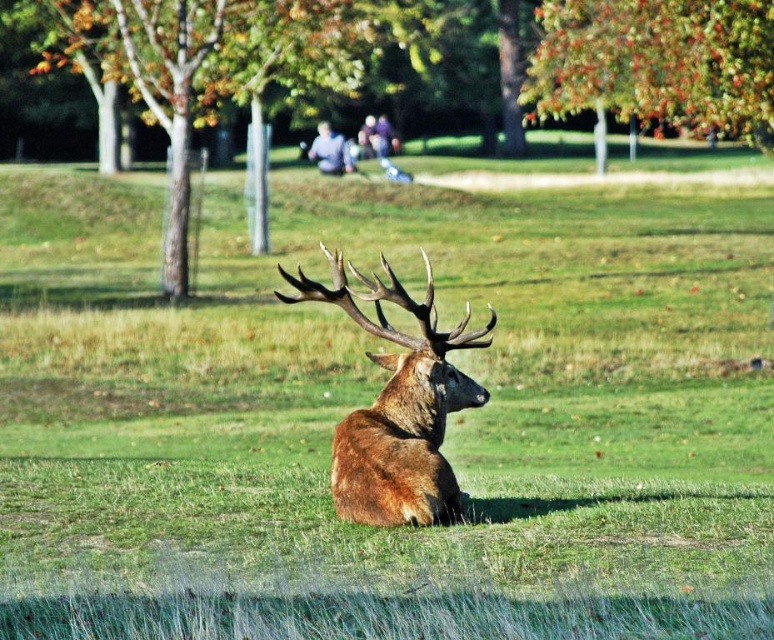
Question: Which of the following is the closest to the observer?

Choices:
 (A) (343, 509)
 (B) (690, 19)

Answer: (A)

Question: Does green leafy tree at upper center appear on the right side of brown velvet deer at center?

Choices:
 (A) yes
 (B) no

Answer: (A)

Question: Can you confirm if green leafy tree at upper center is smaller than brown velvet deer at center?

Choices:
 (A) no
 (B) yes

Answer: (A)

Question: Observing the image, what is the correct spatial positioning of green leafy tree at upper center in reference to brown velvet deer at center?

Choices:
 (A) right
 (B) left

Answer: (A)